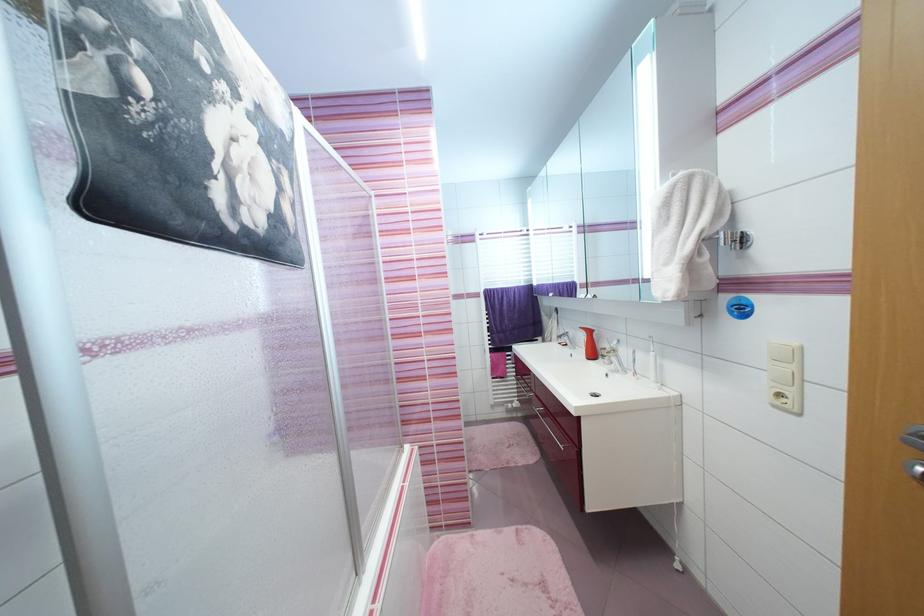
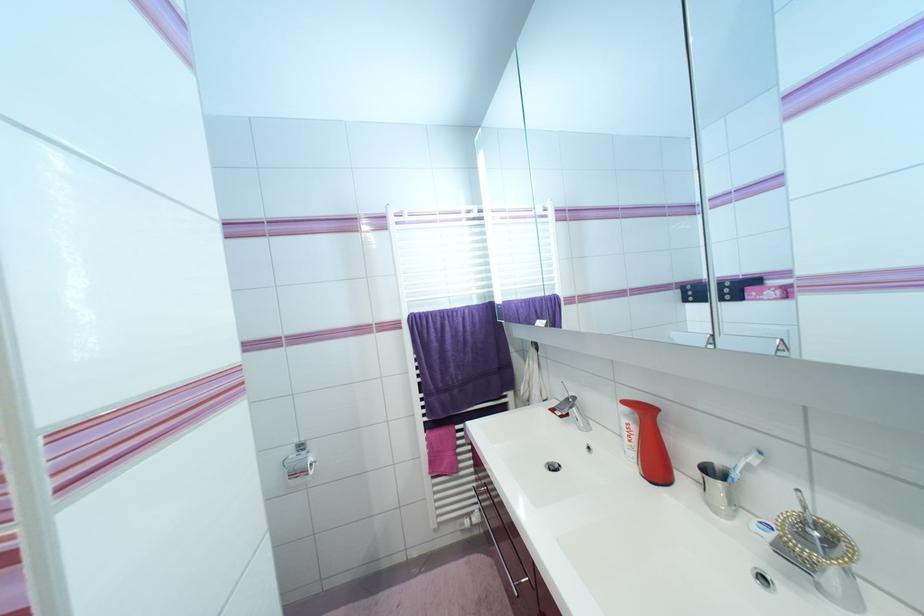
Question: Which direction would the cameraman need to move to produce the second image? Reply with the corresponding letter.

Choices:
 (A) Left
 (B) Right
 (C) Forward
 (D) Backward

Answer: (C)